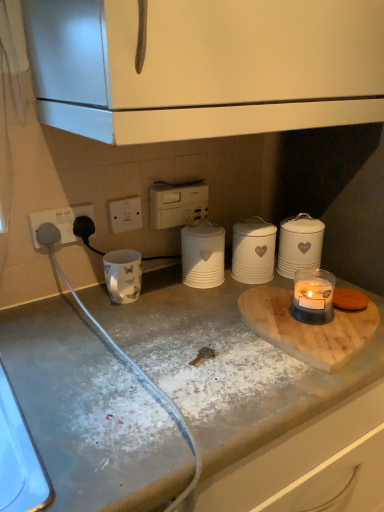
Question: Does translucent glass candle at lower right have a smaller size compared to white matte cabinet at upper center?

Choices:
 (A) no
 (B) yes

Answer: (B)

Question: Is translucent glass candle at lower right further to camera compared to white matte cabinet at upper center?

Choices:
 (A) no
 (B) yes

Answer: (B)

Question: From a real-world perspective, is translucent glass candle at lower right below white matte cabinet at upper center?

Choices:
 (A) no
 (B) yes

Answer: (B)

Question: Would you say translucent glass candle at lower right is outside white matte cabinet at upper center?

Choices:
 (A) yes
 (B) no

Answer: (A)

Question: Considering the relative sizes of translucent glass candle at lower right and white matte cabinet at upper center in the image provided, is translucent glass candle at lower right wider than white matte cabinet at upper center?

Choices:
 (A) no
 (B) yes

Answer: (A)

Question: Relative to wooden cutting board at center, is black rubber power plugs at left in front or behind?

Choices:
 (A) behind
 (B) front

Answer: (A)

Question: Would you say black rubber power plugs at left is inside or outside wooden cutting board at center?

Choices:
 (A) outside
 (B) inside

Answer: (A)

Question: Is point (69, 225) positioned closer to the camera than point (269, 329)?

Choices:
 (A) farther
 (B) closer

Answer: (A)

Question: From the image's perspective, is black rubber power plugs at left positioned above or below wooden cutting board at center?

Choices:
 (A) below
 (B) above

Answer: (B)

Question: Is white ceramic canister at center-right, positioned as the second kitchen appliance in left-to-right order, taller or shorter than translucent glass candle at lower right?

Choices:
 (A) tall
 (B) short

Answer: (A)

Question: Is white ceramic canister at center-right, which ranks as the 1th kitchen appliance in right-to-left order, in front of or behind translucent glass candle at lower right in the image?

Choices:
 (A) front
 (B) behind

Answer: (B)

Question: Is white ceramic canister at center-right, which ranks as the 1th kitchen appliance in right-to-left order, wider or thinner than translucent glass candle at lower right?

Choices:
 (A) wide
 (B) thin

Answer: (A)

Question: Do you think white ceramic canister at center-right, which ranks as the 1th kitchen appliance in right-to-left order, is within translucent glass candle at lower right, or outside of it?

Choices:
 (A) inside
 (B) outside

Answer: (B)

Question: From the image's perspective, relative to wooden cutting board at center, is white plastic electric outlet at center above or below?

Choices:
 (A) below
 (B) above

Answer: (B)

Question: Does point (122, 217) appear closer or farther from the camera than point (288, 352)?

Choices:
 (A) farther
 (B) closer

Answer: (A)